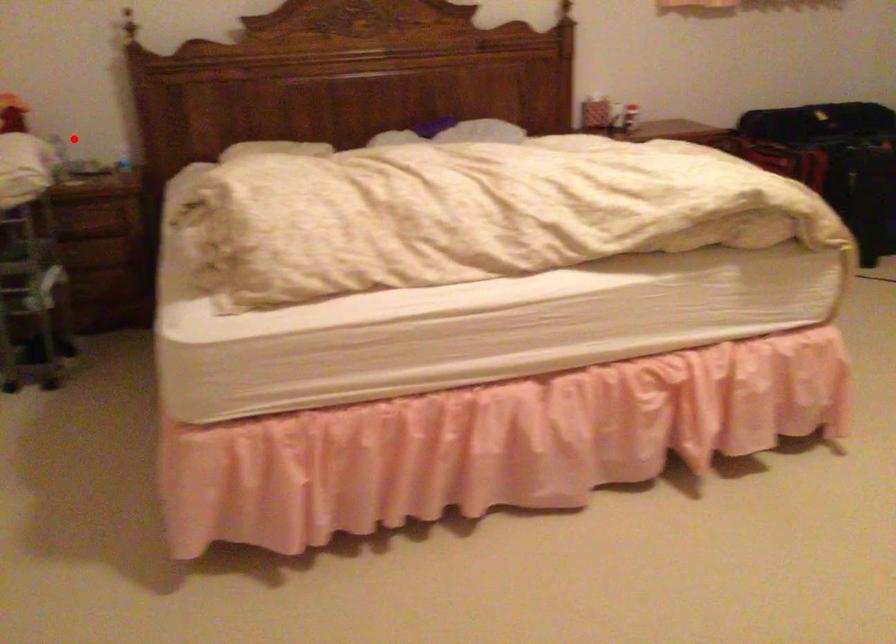
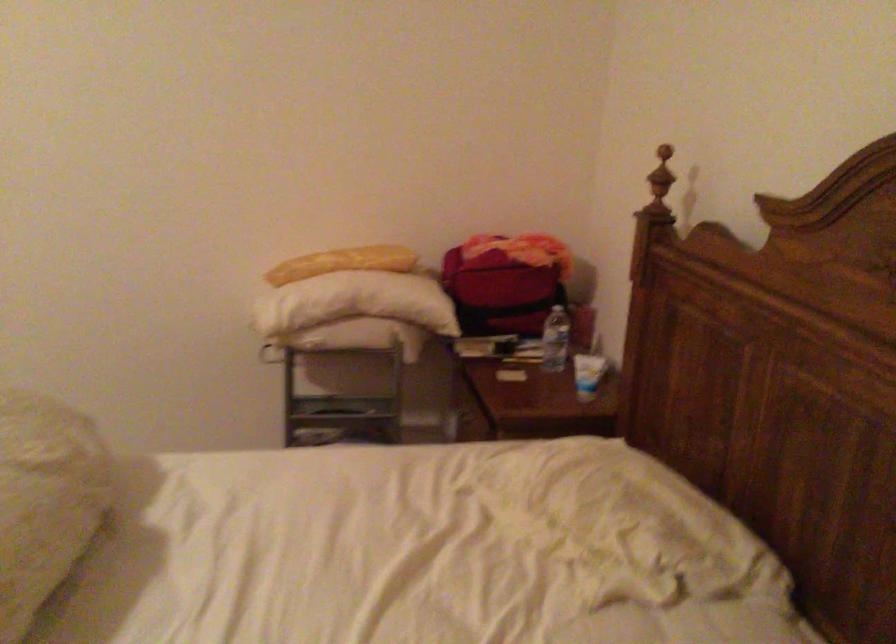
The point at the highlighted location is marked in the first image. Where is the corresponding point in the second image?

(556, 339)